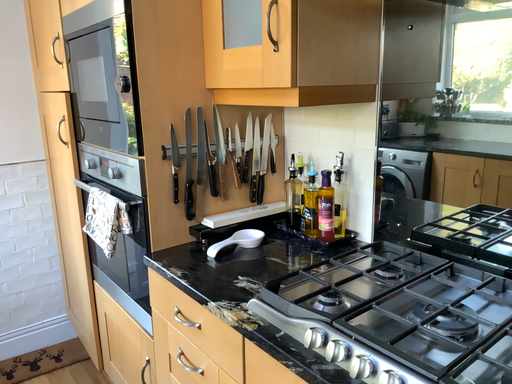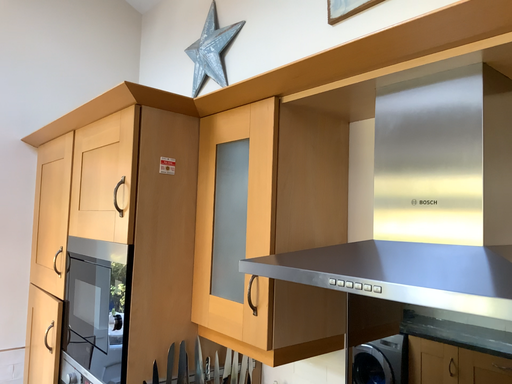
Question: How did the camera likely rotate when shooting the video?

Choices:
 (A) rotated upward
 (B) rotated downward

Answer: (A)